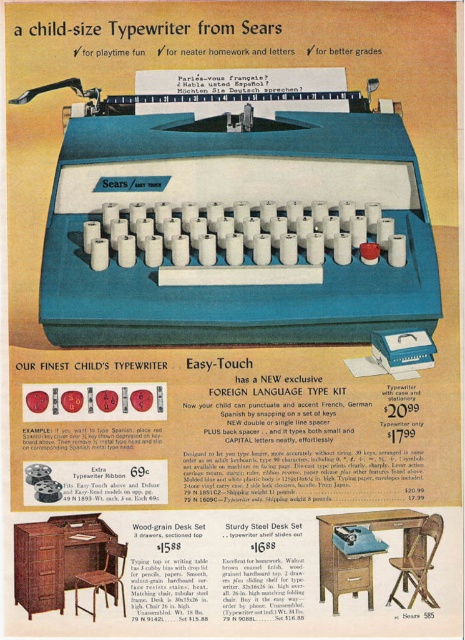
You are a child trying to reach the Sears Easy Touch typewriter displayed in the advertisement. You are standing 1 meter away from the ad. Can you reach the point at coordinates point (x=53, y=589) if your arm can extend 1.2 meters?

The distance of point (x=53, y=589) from the camera is 88.94 centimeters. Since you are standing 1 meter away and your arm can extend 1.2 meters, you can reach the point as 88.94 cm is within your reach range.